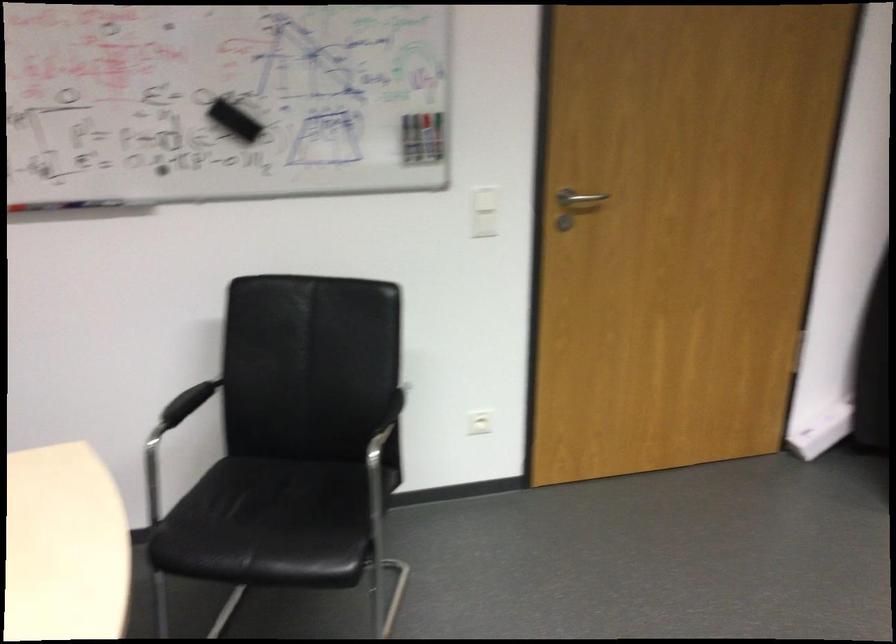
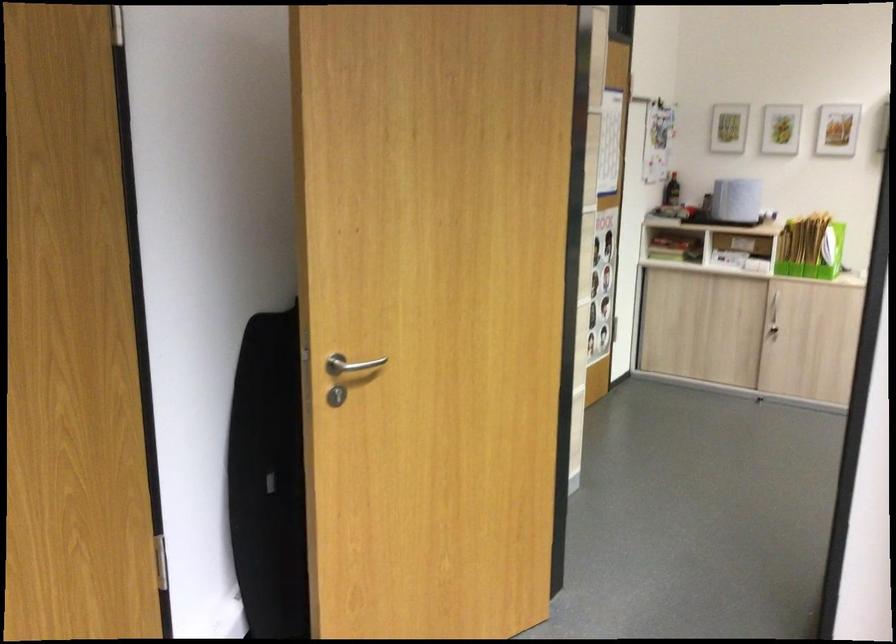
Question: The first image is from the beginning of the video and the second image is from the end. How did the camera likely rotate when shooting the video?

Choices:
 (A) Left
 (B) Right
 (C) Up
 (D) Down

Answer: (B)